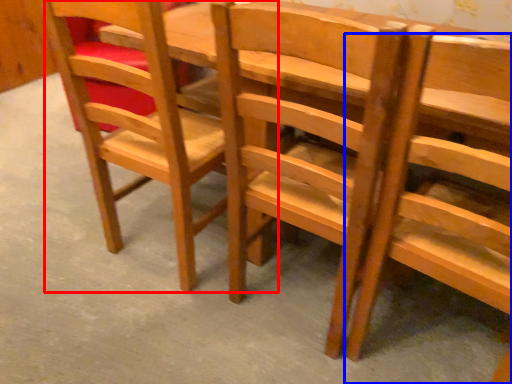
Question: Which of the following is the closest to the observer, chair (highlighted by a red box) or chair (highlighted by a blue box)?

Choices:
 (A) chair
 (B) chair

Answer: (B)